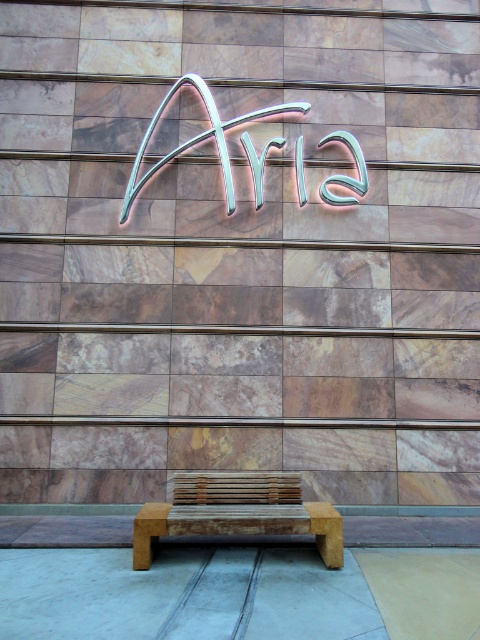
You are standing at the entrance of the building and want to sit down. Where is the rustic wood bench at center located relative to your position?

The rustic wood bench at center is located at point [238,513] relative to your position.

In the scene shown: You are standing in front of the Aria building and want to place a small potted plant on the rustic wood bench at center. The plant needs to be shorter than the metallic neon sign at center to avoid blocking its view. Can the plant be placed there?

The rustic wood bench at center is not as tall as metallic neon sign at center. Since the bench is shorter, placing the plant there would ensure it remains below the height of the sign, so yes, the plant can be placed on the rustic wood bench at center without blocking the view of the metallic neon sign at center.